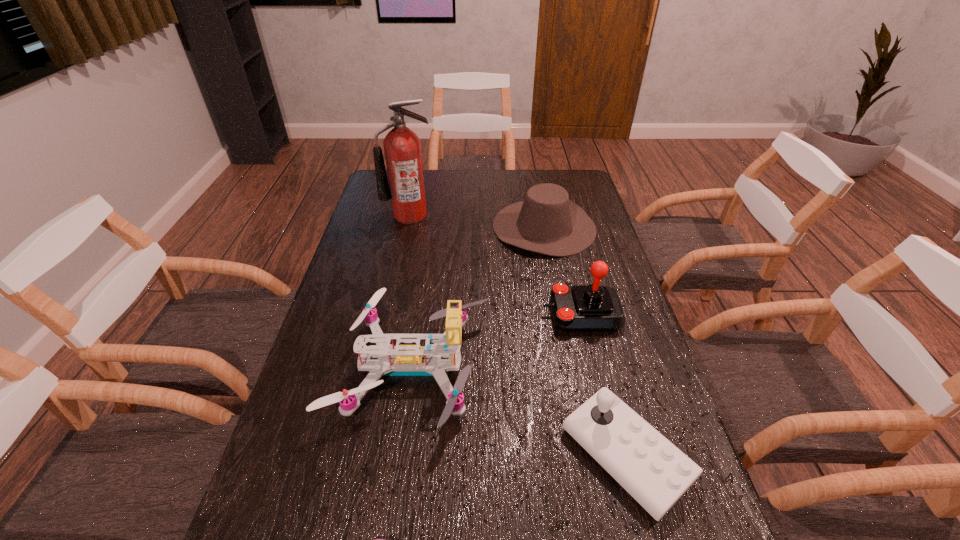
The image size is (960, 540). In order to click on blank area located 0.250m on the left of the cowboy hat in this screenshot , I will do tap(423, 227).

The height and width of the screenshot is (540, 960). In order to click on vacant area situated 0.150m on the left of the shorter joystick in this screenshot , I will do `click(494, 455)`.

At what (x,y) coordinates should I click in order to perform the action: click on fire extinguisher present at the left edge. Please return your answer as a coordinate pair (x, y). The height and width of the screenshot is (540, 960). Looking at the image, I should click on (402, 147).

Where is `drone located at the left edge`? The image size is (960, 540). drone located at the left edge is located at coordinates pos(401,360).

In order to click on cowboy hat positioned at the right edge in this screenshot , I will do `click(547, 222)`.

This screenshot has width=960, height=540. Identify the location of vacant space at the far edge. (496, 177).

You are a GUI agent. You are given a task and a screenshot of the screen. Output one action in this format:
    pyautogui.click(x=<x>, y=<y>)
    Task: Click on the vacant space at the left edge of the desktop
    Image resolution: width=960 pixels, height=540 pixels.
    Given the screenshot: What is the action you would take?
    pyautogui.click(x=332, y=445)

In the image, there is a desktop. Where is `free region at the right edge`? The image size is (960, 540). free region at the right edge is located at coordinates (599, 237).

I want to click on free space at the far right corner of the desktop, so click(578, 197).

The width and height of the screenshot is (960, 540). Identify the location of vacant area that lies between the cowboy hat and the nearer joystick. (585, 341).